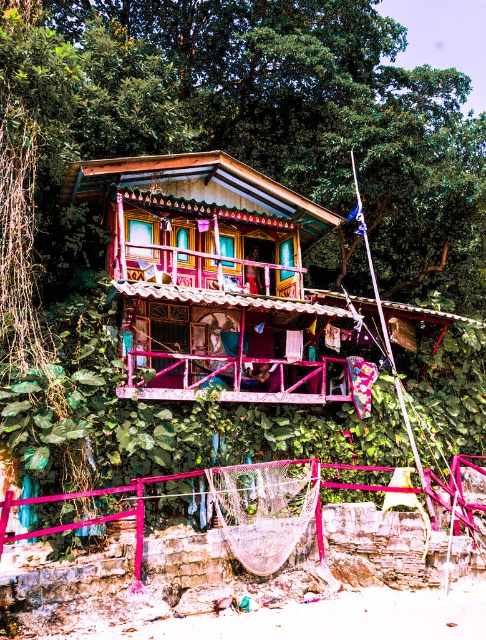
Measure the distance between green leafy tree at upper center and pink metal/rail at center.

green leafy tree at upper center is 41.24 feet from pink metal/rail at center.

Which is more to the right, green leafy tree at upper center or pink metal/rail at center?

pink metal/rail at center

Is point (358, 170) positioned behind point (96, 522)?

Yes, it is.

This screenshot has width=486, height=640. What are the coordinates of `green leafy tree at upper center` in the screenshot? It's located at (263, 115).

Between green leafy tree at upper center and pink painted wood balcony at center, which one has more height?

Standing taller between the two is green leafy tree at upper center.

Does green leafy tree at upper center have a greater height compared to pink painted wood balcony at center?

Yes.

Is point (386, 125) closer to camera compared to point (232, 381)?

No, (386, 125) is further to viewer.

Locate an element on the screen. This screenshot has height=640, width=486. green leafy tree at upper center is located at coordinates (263, 115).

Describe the element at coordinates (232, 509) in the screenshot. I see `pink metal/rail at center` at that location.

Which is below, pink metal/rail at center or pink painted wood balcony at center?

Positioned lower is pink metal/rail at center.

The width and height of the screenshot is (486, 640). Identify the location of pink metal/rail at center. (x=232, y=509).

Locate an element on the screen. This screenshot has height=640, width=486. pink metal/rail at center is located at coordinates (232, 509).